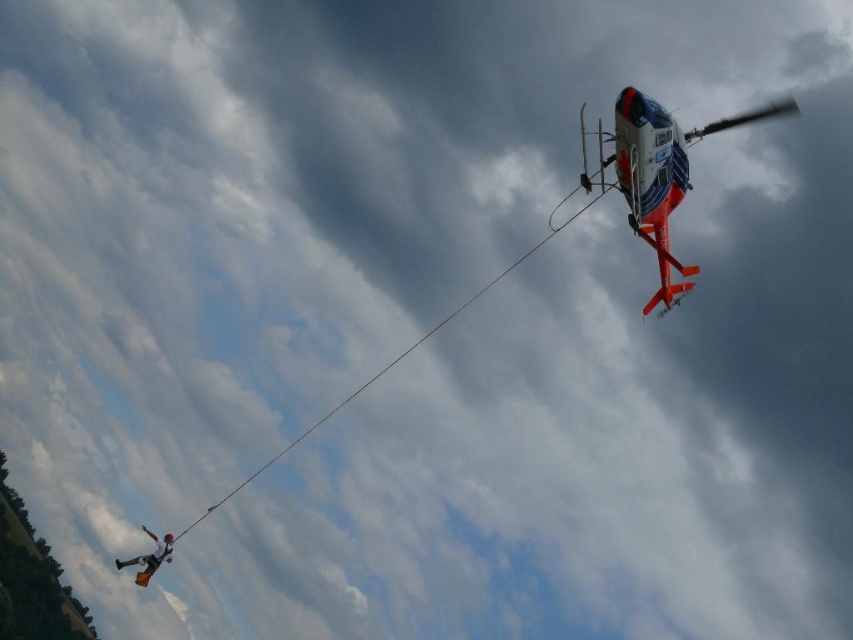
Question: Which object is closer to the camera taking this photo?

Choices:
 (A) smooth rope at upper right
 (B) white fabric parachute at lower left

Answer: (A)

Question: Estimate the real-world distances between objects in this image. Which object is farther from the smooth rope at upper right?

Choices:
 (A) white fabric parachute at lower left
 (B) orange metallic helicopter at upper right

Answer: (A)

Question: Observing the image, what is the correct spatial positioning of orange metallic helicopter at upper right in reference to smooth rope at upper right?

Choices:
 (A) above
 (B) below

Answer: (A)

Question: Is smooth rope at upper right above white fabric parachute at lower left?

Choices:
 (A) no
 (B) yes

Answer: (B)

Question: Which object is the farthest from the orange metallic helicopter at upper right?

Choices:
 (A) smooth rope at upper right
 (B) white fabric parachute at lower left

Answer: (B)

Question: Is smooth rope at upper right to the right of white fabric parachute at lower left from the viewer's perspective?

Choices:
 (A) no
 (B) yes

Answer: (B)